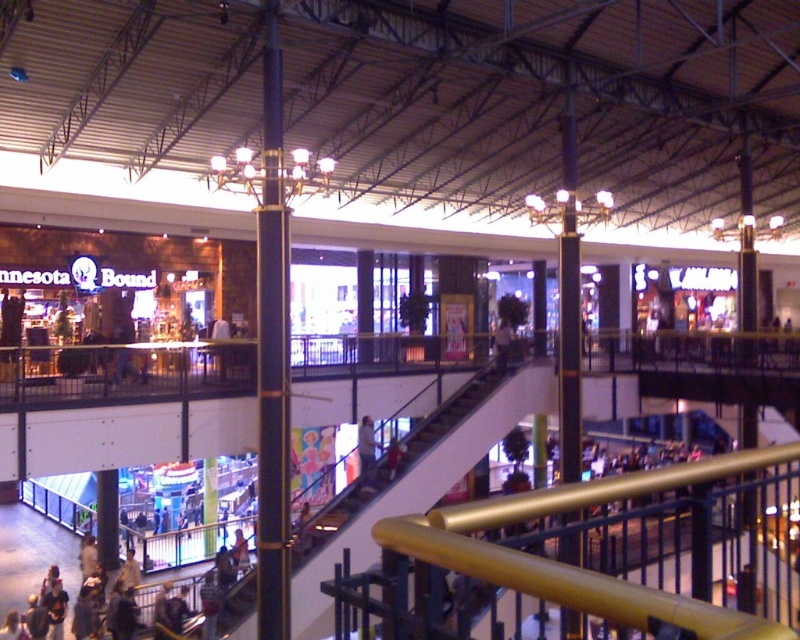
You are a customer standing at the entrance of the mall. You see the white plastic escalator at center and the light blue jeans at center. Which object is taller?

The white plastic escalator at center is much taller than the light blue jeans at center.

You are standing at the entrance of the Minnesota Bound store on the lower level of the mall. You see two points in the image, point 1 at coordinates point (254,632) and point 2 at coordinates point (360,461). Which point is nearer to you?

Point (254,632) is closer to the viewer than point (360,461).